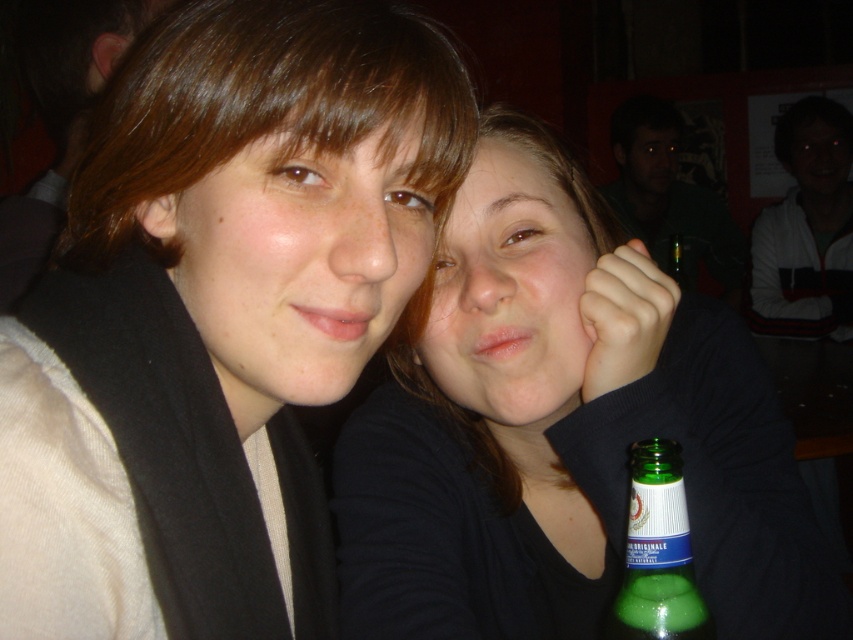
Can you confirm if matte black scarf at upper left is positioned below green glass bottle at lower center?

Actually, matte black scarf at upper left is above green glass bottle at lower center.

Does matte black scarf at upper left appear on the left side of green glass bottle at lower center?

Correct, you'll find matte black scarf at upper left to the left of green glass bottle at lower center.

Which is behind, point (135, 480) or point (654, 436)?

Point (654, 436)

Where is `matte black scarf at upper left`? This screenshot has width=853, height=640. matte black scarf at upper left is located at coordinates (218, 316).

Does point (732, 296) lie in front of point (674, 554)?

No, (732, 296) is further to viewer.

This screenshot has width=853, height=640. What do you see at coordinates (669, 196) in the screenshot?
I see `green glass bottle at upper right` at bounding box center [669, 196].

Is point (735, 289) positioned after point (683, 614)?

Yes, it is.

You are a GUI agent. You are given a task and a screenshot of the screen. Output one action in this format:
    pyautogui.click(x=<x>, y=<y>)
    Task: Click on the green glass bottle at upper right
    The image size is (853, 640).
    Given the screenshot: What is the action you would take?
    pyautogui.click(x=669, y=196)

From the picture: Is matte black shirt at center wider than green glass bottle at upper right?

In fact, matte black shirt at center might be narrower than green glass bottle at upper right.

Is point (726, 424) less distant than point (660, 211)?

Yes, it is in front of point (660, 211).

Where is `matte black shirt at center`? The height and width of the screenshot is (640, 853). matte black shirt at center is located at coordinates (561, 429).